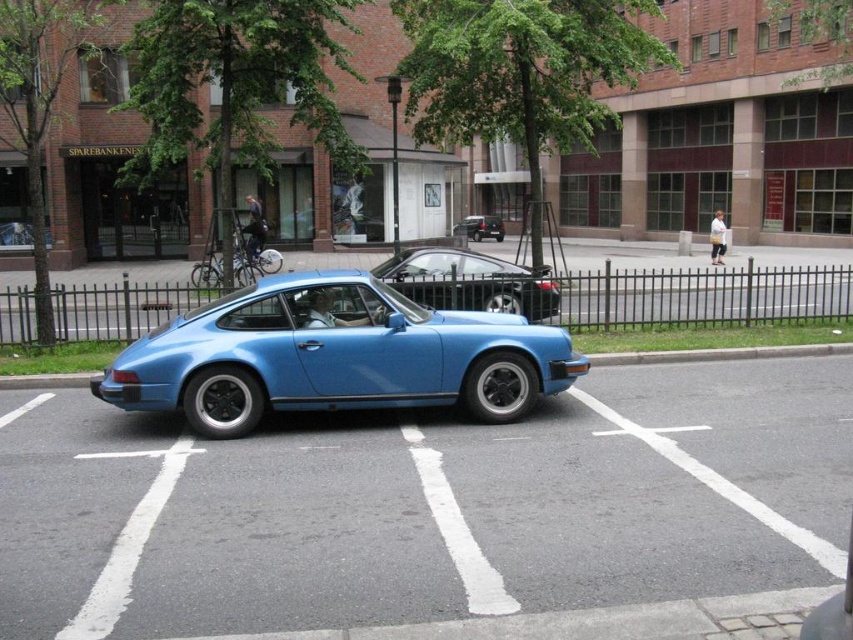
Question: Which object is closer to the camera taking this photo?

Choices:
 (A) satin blue car at center
 (B) shiny black car at center

Answer: (A)

Question: Among these points, which one is farthest from the camera?

Choices:
 (A) (440, 248)
 (B) (326, 358)

Answer: (A)

Question: From the image, what is the correct spatial relationship of satin blue car at center in relation to metallic silver car at center?

Choices:
 (A) right
 (B) left

Answer: (B)

Question: Estimate the real-world distances between objects in this image. Which object is farther from the shiny black car at center?

Choices:
 (A) satin blue car at center
 (B) metallic silver car at center

Answer: (B)

Question: Is satin blue car at center above shiny black car at center?

Choices:
 (A) no
 (B) yes

Answer: (A)

Question: Does satin blue car at center appear under metallic silver car at center?

Choices:
 (A) no
 (B) yes

Answer: (B)